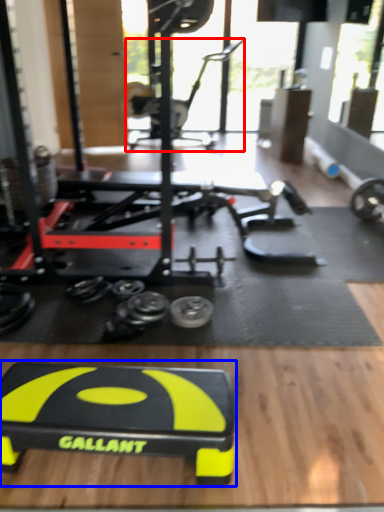
Question: Which of the following is the farthest to the observer, sport equipment (highlighted by a red box) or sport equipment (highlighted by a blue box)?

Choices:
 (A) sport equipment
 (B) sport equipment

Answer: (A)